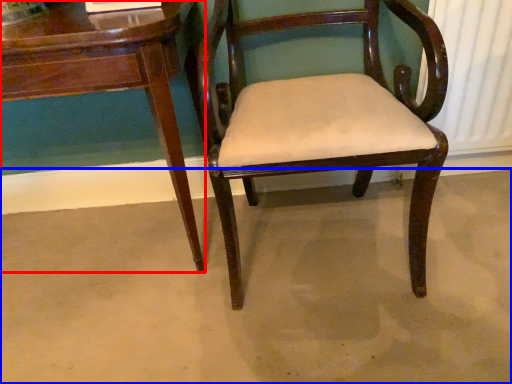
Question: Which object appears closest to the camera in this image, table (highlighted by a red box) or concrete (highlighted by a blue box)?

Choices:
 (A) table
 (B) concrete

Answer: (A)